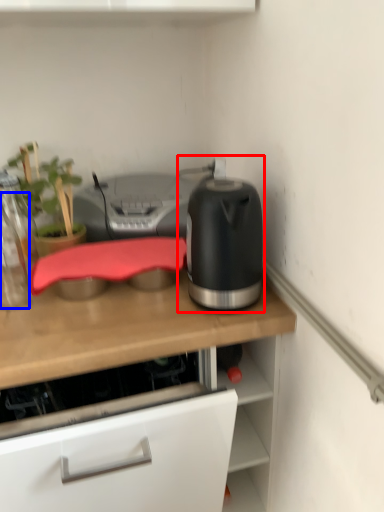
Question: Which of the following is the closest to the observer, kitchen appliance (highlighted by a red box) or bottle (highlighted by a blue box)?

Choices:
 (A) kitchen appliance
 (B) bottle

Answer: (A)